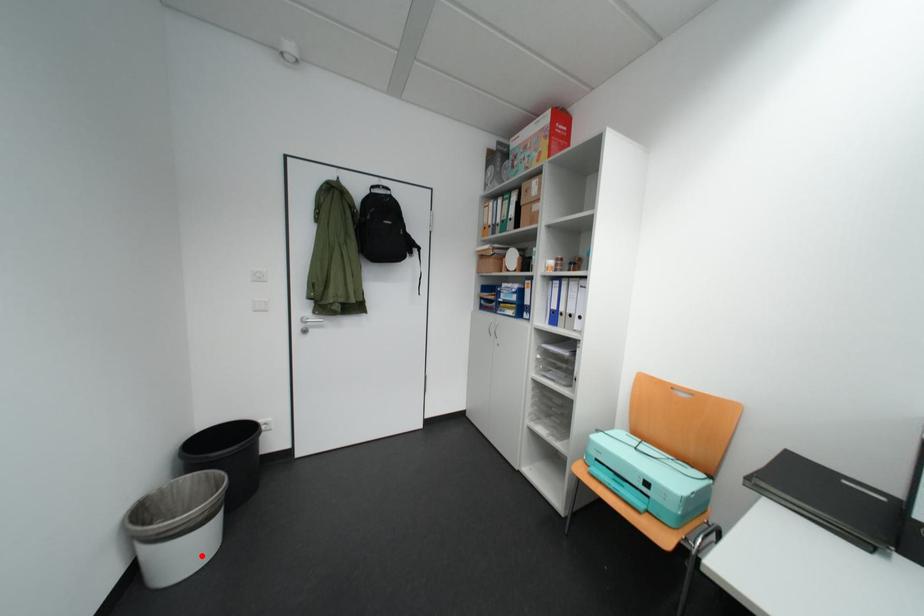
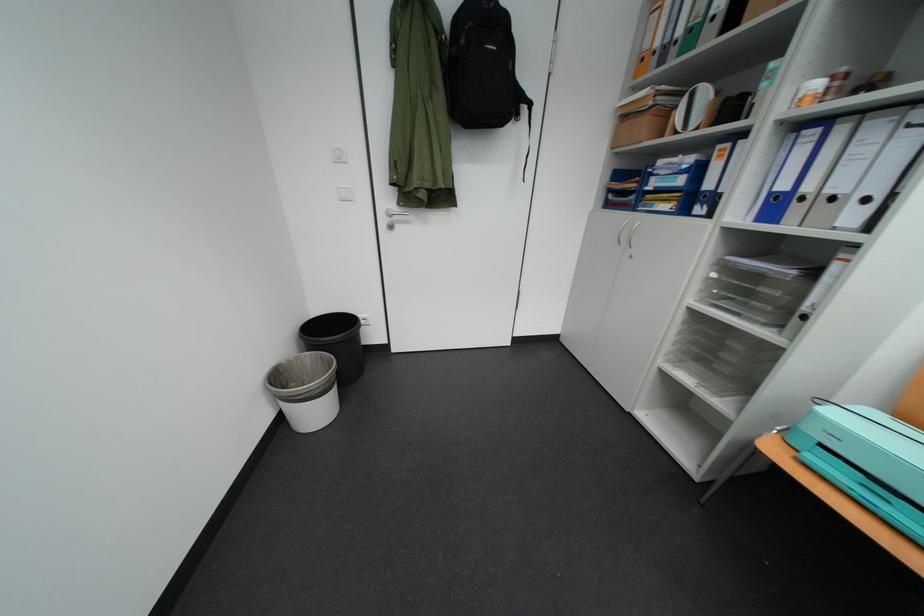
Question: I am providing you with two images of the same scene from different viewpoints. Given a red point in image1, look at the same physical point in image2. Is it:

Choices:
 (A) Closer to the viewpoint
 (B) Farther from the viewpoint

Answer: (B)